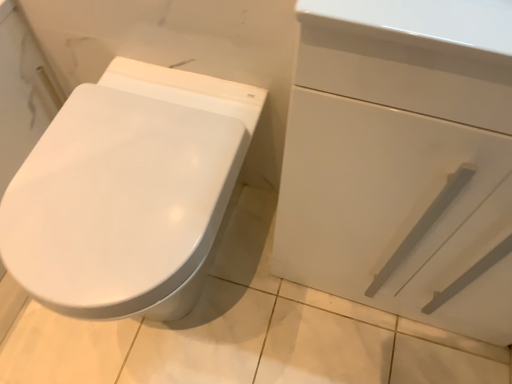
Question: Looking at the image, does white glossy bidet at left seem bigger or smaller compared to white glossy drawer at right?

Choices:
 (A) big
 (B) small

Answer: (B)

Question: In terms of width, does white glossy bidet at left look wider or thinner when compared to white glossy drawer at right?

Choices:
 (A) wide
 (B) thin

Answer: (A)

Question: Does point (66, 253) appear closer or farther from the camera than point (311, 172)?

Choices:
 (A) closer
 (B) farther

Answer: (A)

Question: Is white glossy drawer at right in front of or behind white glossy bidet at left in the image?

Choices:
 (A) behind
 (B) front

Answer: (B)

Question: Based on their sizes in the image, would you say white glossy drawer at right is bigger or smaller than white glossy bidet at left?

Choices:
 (A) small
 (B) big

Answer: (B)

Question: Does point coord(417,147) appear closer or farther from the camera than point coord(179,213)?

Choices:
 (A) closer
 (B) farther

Answer: (A)

Question: In terms of width, does white glossy drawer at right look wider or thinner when compared to white glossy bidet at left?

Choices:
 (A) thin
 (B) wide

Answer: (A)